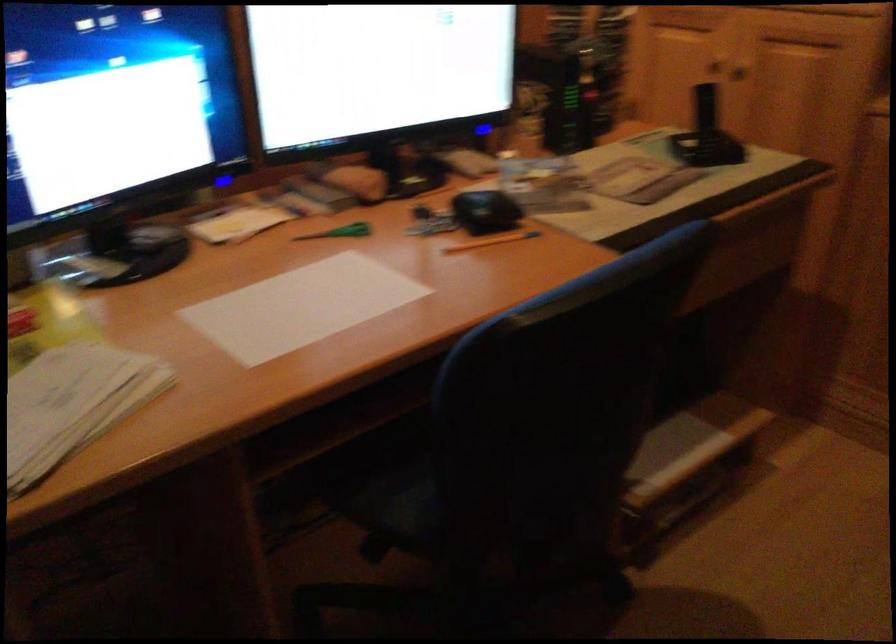
Which object does [340,232] point to?

This point indicates the green handle scissors.